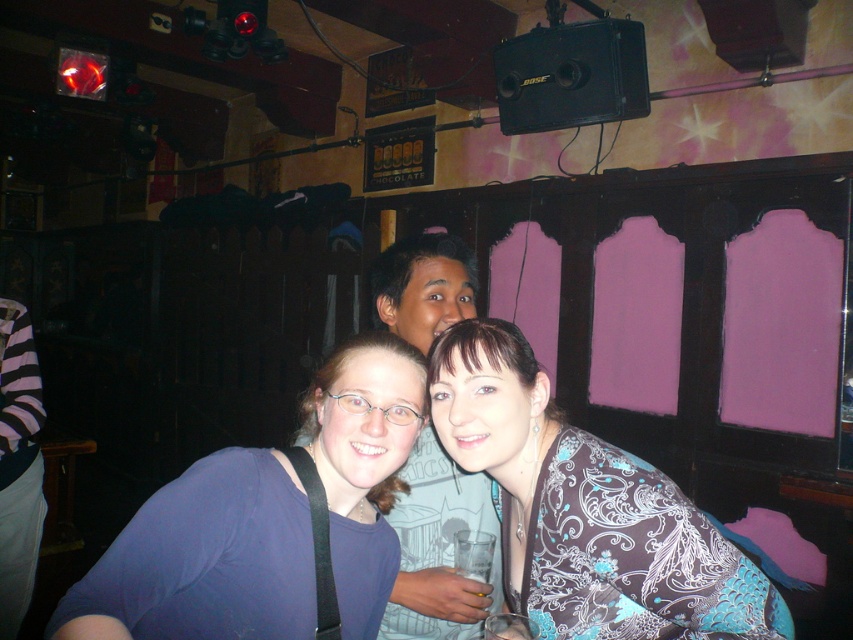
Can you confirm if blue fabric shirt at center is taller than patterned fabric dress at center?

In fact, blue fabric shirt at center may be shorter than patterned fabric dress at center.

Locate an element on the screen. The width and height of the screenshot is (853, 640). blue fabric shirt at center is located at coordinates (206, 557).

From the picture: Which of these two, blue fabric shirt at center or matte gray t-shirt at center, stands taller?

With more height is matte gray t-shirt at center.

Is blue fabric shirt at center shorter than matte gray t-shirt at center?

Yes.

Does point (57, 628) come behind point (445, 292)?

No, it is in front of (445, 292).

Identify the location of blue fabric shirt at center. This screenshot has width=853, height=640. (206, 557).

Is patterned fabric dress at center below matte gray t-shirt at center?

Correct, patterned fabric dress at center is located below matte gray t-shirt at center.

Which is behind, point (500, 497) or point (432, 541)?

The point (432, 541) is behind.

The height and width of the screenshot is (640, 853). In order to click on patterned fabric dress at center in this screenshot , I will do `click(585, 509)`.